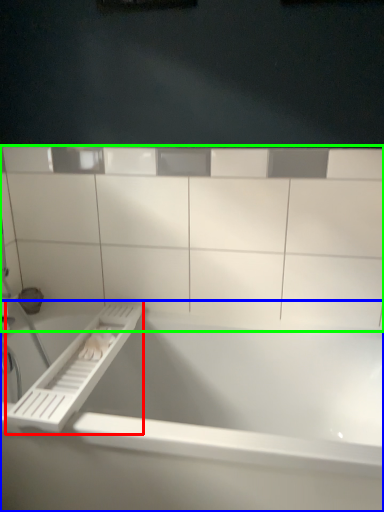
Question: Which is farther away from towel bar (highlighted by a red box)? bathtub (highlighted by a blue box) or ledge (highlighted by a green box)?

Choices:
 (A) bathtub
 (B) ledge

Answer: (B)